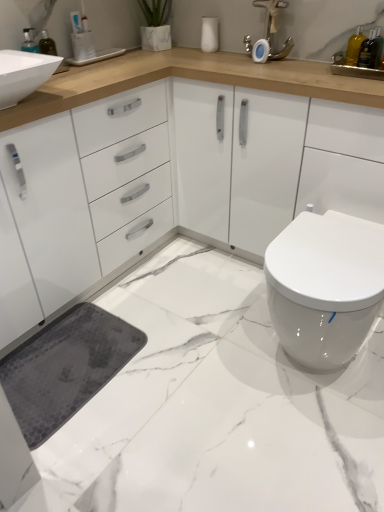
Find the location of a particular element. This screenshot has height=512, width=384. vacant area that is in front of translucent glass bottle at upper right, the 2th toiletry positioned from the left is located at coordinates (364, 81).